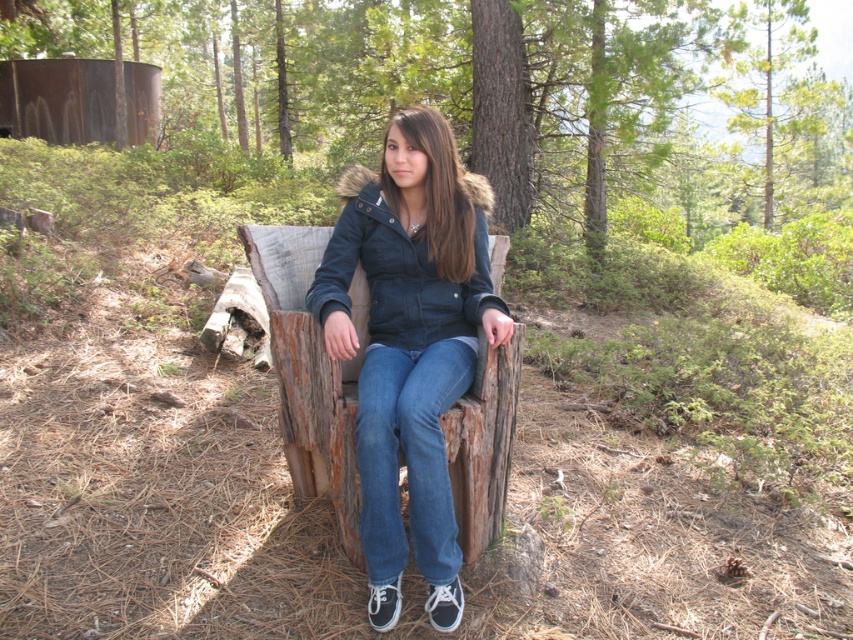
You are a hiker who wants to know which item of clothing is larger between the denim jacket at center and the denim at center. Which one is bigger?

The denim jacket at center is bigger than the denim at center.

You are a photographer trying to capture the scene with the denim jacket at center and denim at center. Which object should you adjust your camera focus to first if you want to ensure both are in focus, considering their positions?

You should focus on the denim jacket at center first because it is closer to the camera than the denim at center, ensuring both will be in focus when using depth of field properly.